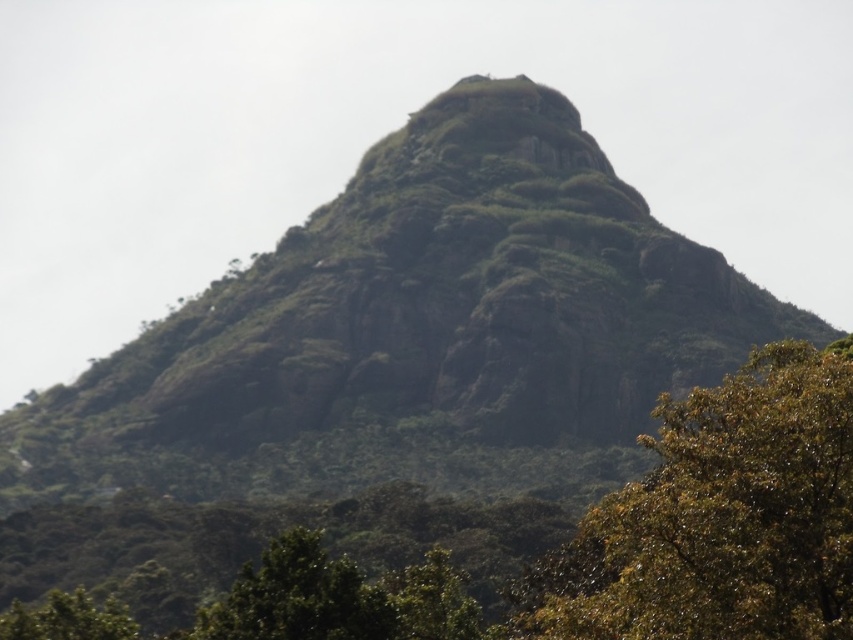
You are a hiker standing at the point with coordinates (718, 516). What can you see directly in front of you?

At point (718, 516) lies green leafy tree at center, so you can see the green leafy tree at center directly in front of you.

You are a hiker trying to determine the best path up the mountain. You notice two trees, the green leafy tree at center and the green leafy tree at lower left. Which tree would you choose to navigate around if you want to take the wider path?

The green leafy tree at center might be wider than green leafy tree at lower left, so choosing to navigate around the green leafy tree at center would likely provide a wider path.